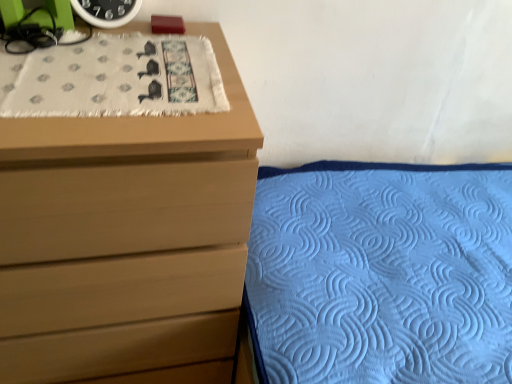
Locate an element on the screen. The height and width of the screenshot is (384, 512). green matte clock at upper left is located at coordinates (106, 11).

This screenshot has height=384, width=512. I want to click on white textured cloth at upper left, so click(x=113, y=78).

From a real-world perspective, relative to white textured cloth at upper left, is green matte clock at upper left vertically above or below?

Clearly, from a real-world perspective, green matte clock at upper left is above white textured cloth at upper left.

Which object is wider, green matte clock at upper left or white textured cloth at upper left?

white textured cloth at upper left.

Which object is closer to the camera taking this photo, green matte clock at upper left or white textured cloth at upper left?

white textured cloth at upper left is in front.

Would you consider green matte clock at upper left to be distant from white textured cloth at upper left?

No, green matte clock at upper left is in close proximity to white textured cloth at upper left.

From a real-world perspective, is matte wood chest of drawers at upper left physically located above or below white textured cloth at upper left?

In terms of real-world spatial position, matte wood chest of drawers at upper left is below white textured cloth at upper left.

Could you tell me if matte wood chest of drawers at upper left is facing white textured cloth at upper left?

No.

Does matte wood chest of drawers at upper left have a smaller size compared to white textured cloth at upper left?

No.

How distant is matte wood chest of drawers at upper left from white textured cloth at upper left?

The distance of matte wood chest of drawers at upper left from white textured cloth at upper left is 9.88 inches.

From the image's perspective, which is below, blue quilted fabric at lower right or white textured cloth at upper left?

blue quilted fabric at lower right.

Is blue quilted fabric at lower right facing away from white textured cloth at upper left?

No, blue quilted fabric at lower right is not facing the opposite direction of white textured cloth at upper left.

In the image, is blue quilted fabric at lower right positioned in front of or behind white textured cloth at upper left?

blue quilted fabric at lower right is in front of white textured cloth at upper left.

Can white textured cloth at upper left be found inside blue quilted fabric at lower right?

No, white textured cloth at upper left is not inside blue quilted fabric at lower right.

Is white textured cloth at upper left positioned far away from green matte clock at upper left?

Actually, white textured cloth at upper left and green matte clock at upper left are a little close together.

Can you confirm if white textured cloth at upper left is positioned to the right of green matte clock at upper left?

Yes.

This screenshot has width=512, height=384. I want to click on clock that appears above the white textured cloth at upper left (from the image's perspective), so click(106, 11).

Which is in front, point (386, 325) or point (73, 191)?

The point (73, 191) is more forward.

Is blue quilted fabric at lower right next to matte wood chest of drawers at upper left and touching it?

No, blue quilted fabric at lower right is not making contact with matte wood chest of drawers at upper left.

This screenshot has height=384, width=512. I want to click on mattress in front of the matte wood chest of drawers at upper left, so click(381, 273).

Is blue quilted fabric at lower right shorter than matte wood chest of drawers at upper left?

Correct, blue quilted fabric at lower right is not as tall as matte wood chest of drawers at upper left.

Considering the sizes of green matte clock at upper left and blue quilted fabric at lower right in the image, is green matte clock at upper left bigger or smaller than blue quilted fabric at lower right?

Considering their sizes, green matte clock at upper left takes up less space than blue quilted fabric at lower right.

Identify the location of clock that is above the blue quilted fabric at lower right (from the image's perspective). This screenshot has width=512, height=384. (106, 11).

Which is closer, (72, 0) or (447, 338)?

The point (72, 0) is closer to the camera.

Which object is further away from the camera, matte wood chest of drawers at upper left or blue quilted fabric at lower right?

matte wood chest of drawers at upper left is further away from the camera.

Which object is thinner, matte wood chest of drawers at upper left or blue quilted fabric at lower right?

Thinner between the two is matte wood chest of drawers at upper left.

Where is `chest of drawers behind the blue quilted fabric at lower right`? This screenshot has height=384, width=512. chest of drawers behind the blue quilted fabric at lower right is located at coordinates (126, 241).

Is the surface of matte wood chest of drawers at upper left in direct contact with blue quilted fabric at lower right?

matte wood chest of drawers at upper left is not next to blue quilted fabric at lower right, and they're not touching.

Find the location of a particular element. This screenshot has height=384, width=512. blanket in front of the green matte clock at upper left is located at coordinates (113, 78).

The height and width of the screenshot is (384, 512). I want to click on chest of drawers on the left side of white textured cloth at upper left, so click(126, 241).

Which object lies nearer to the anchor point green matte clock at upper left, blue quilted fabric at lower right or matte wood chest of drawers at upper left?

Among the two, matte wood chest of drawers at upper left is located nearer to green matte clock at upper left.

In the scene shown: Looking at the image, which one is located closer to white textured cloth at upper left, matte wood chest of drawers at upper left or green matte clock at upper left?

green matte clock at upper left lies closer to white textured cloth at upper left than the other object.

From the picture: Based on their spatial positions, is blue quilted fabric at lower right or green matte clock at upper left further from matte wood chest of drawers at upper left?

Among the two, green matte clock at upper left is located further to matte wood chest of drawers at upper left.

Consider the image. Estimate the real-world distances between objects in this image. Which object is further from matte wood chest of drawers at upper left, white textured cloth at upper left or green matte clock at upper left?

Among the two, green matte clock at upper left is located further to matte wood chest of drawers at upper left.

Which object lies further to the anchor point matte wood chest of drawers at upper left, green matte clock at upper left or blue quilted fabric at lower right?

green matte clock at upper left.

Estimate the real-world distances between objects in this image. Which object is further from green matte clock at upper left, matte wood chest of drawers at upper left or blue quilted fabric at lower right?

blue quilted fabric at lower right.

Based on their spatial positions, is green matte clock at upper left or matte wood chest of drawers at upper left further from white textured cloth at upper left?

The object further to white textured cloth at upper left is matte wood chest of drawers at upper left.

Estimate the real-world distances between objects in this image. Which object is further from blue quilted fabric at lower right, matte wood chest of drawers at upper left or green matte clock at upper left?

Among the two, green matte clock at upper left is located further to blue quilted fabric at lower right.

The image size is (512, 384). In order to click on blanket between green matte clock at upper left and matte wood chest of drawers at upper left in the up-down direction in this screenshot , I will do `click(113, 78)`.

The image size is (512, 384). Identify the location of blanket between matte wood chest of drawers at upper left and blue quilted fabric at lower right in the horizontal direction. click(113, 78).

At what (x,y) coordinates should I click in order to perform the action: click on blanket between green matte clock at upper left and blue quilted fabric at lower right from left to right. Please return your answer as a coordinate pair (x, y). The height and width of the screenshot is (384, 512). Looking at the image, I should click on (113, 78).

Where is `clock located between matte wood chest of drawers at upper left and blue quilted fabric at lower right in the left-right direction`? The image size is (512, 384). clock located between matte wood chest of drawers at upper left and blue quilted fabric at lower right in the left-right direction is located at coordinates (106, 11).